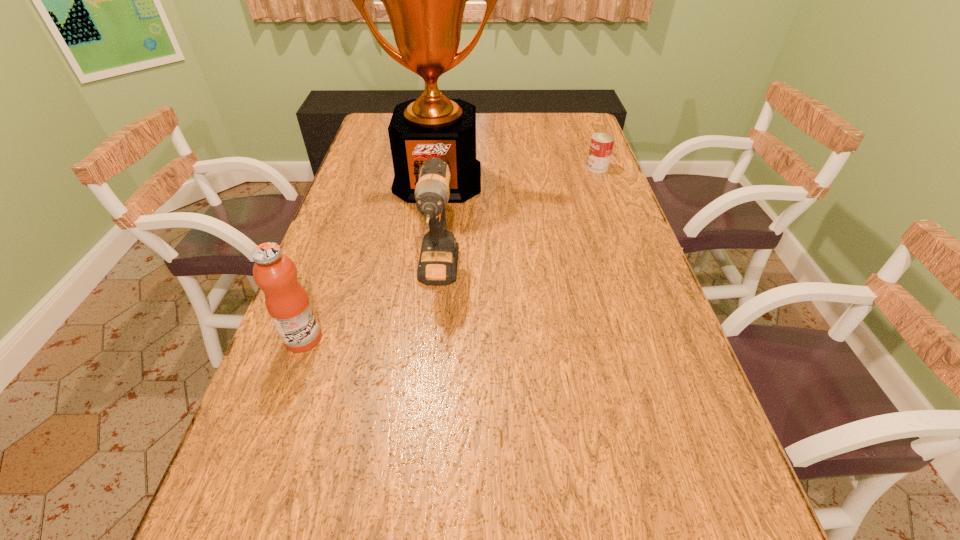
Find the location of a particular element. The width and height of the screenshot is (960, 540). the tallest object is located at coordinates (425, 0).

You are a GUI agent. You are given a task and a screenshot of the screen. Output one action in this format:
    pyautogui.click(x=<x>, y=<y>)
    Task: Click on the third farthest object
    Image resolution: width=960 pixels, height=540 pixels.
    Given the screenshot: What is the action you would take?
    pyautogui.click(x=438, y=260)

Identify the location of the nearest object. The image size is (960, 540). (287, 302).

I want to click on the rightmost object, so [601, 146].

This screenshot has height=540, width=960. I want to click on the shortest object, so click(601, 146).

Identify the location of vacant area situated 0.300m on the front of the tallest object with the label. The image size is (960, 540). (426, 271).

Where is `free space located 0.140m with the drill bit of the third farthest object facing forward`? The image size is (960, 540). free space located 0.140m with the drill bit of the third farthest object facing forward is located at coordinates (430, 357).

Where is `vacant space located 0.340m on the front label of the nearest object`? This screenshot has width=960, height=540. vacant space located 0.340m on the front label of the nearest object is located at coordinates (476, 339).

You are a GUI agent. You are given a task and a screenshot of the screen. Output one action in this format:
    pyautogui.click(x=<x>, y=<y>)
    Task: Click on the free region located on the front label of the shortest object
    This screenshot has width=960, height=540.
    Given the screenshot: What is the action you would take?
    pyautogui.click(x=487, y=167)

The height and width of the screenshot is (540, 960). Identify the location of blank area located 0.110m on the front label of the shortest object. (554, 167).